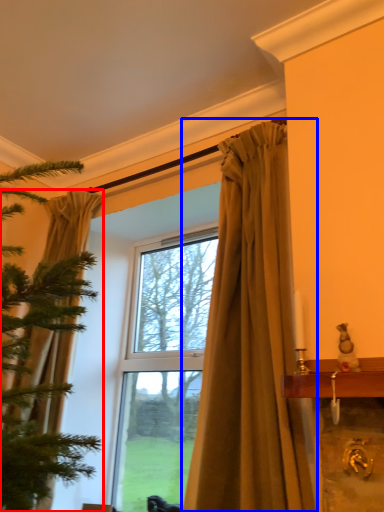
Question: Which object appears closest to the camera in this image, curtain (highlighted by a red box) or curtain (highlighted by a blue box)?

Choices:
 (A) curtain
 (B) curtain

Answer: (B)